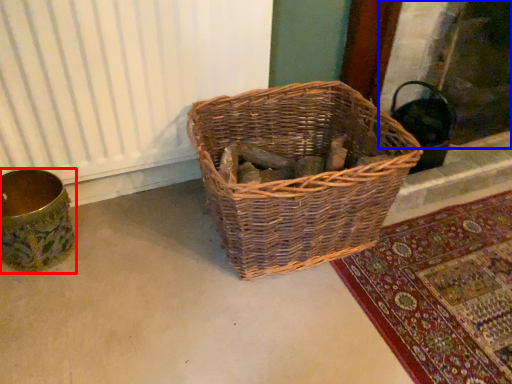
Question: Which point is further to the camera, flower basket (highlighted by a red box) or fireplace (highlighted by a blue box)?

Choices:
 (A) flower basket
 (B) fireplace

Answer: (B)